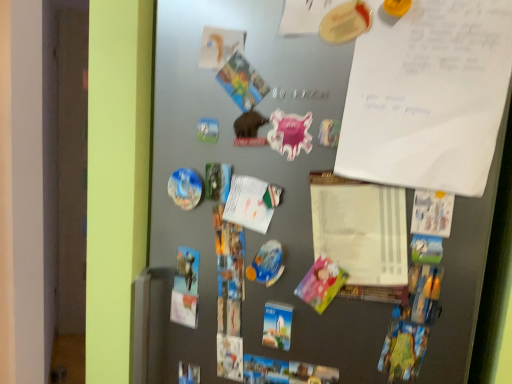
Find the location of `glossy plastic magnet at center-left, the second art positioned from the front`. glossy plastic magnet at center-left, the second art positioned from the front is located at coordinates (185, 188).

Where is `white paper at center`? This screenshot has height=384, width=512. white paper at center is located at coordinates (362, 231).

What is the approximate height of white paper at upper right?

white paper at upper right is 11.91 inches in height.

What are the coordinates of `white paper at upper right` in the screenshot? It's located at (428, 96).

Measure the distance between pink paper postcard at center-right and camera.

pink paper postcard at center-right is 26.39 inches away from camera.

This screenshot has height=384, width=512. Describe the element at coordinates (321, 283) in the screenshot. I see `pink paper postcard at center-right` at that location.

You are a GUI agent. You are given a task and a screenshot of the screen. Output one action in this format:
    pyautogui.click(x=<x>, y=<y>)
    Task: Click on the glossy plastic magnet at center-left, which is the first art from left to right
    The width and height of the screenshot is (512, 384).
    Given the screenshot: What is the action you would take?
    185,188

At what (x,y) coordinates should I click in order to perform the action: click on postcard on the left of white paper at center. Please return your answer as a coordinate pair (x, y). The image size is (512, 384). Looking at the image, I should click on (321, 283).

Is pink paper postcard at center-right bigger than white paper at center?

Actually, pink paper postcard at center-right might be smaller than white paper at center.

Based on the photo, from a real-world perspective, is pink paper postcard at center-right physically above white paper at center?

No, from a real-world perspective, pink paper postcard at center-right is not above white paper at center.

Which of these two, pink paper postcard at center-right or white paper at center, stands shorter?

With less height is pink paper postcard at center-right.

Is white paper at center in contact with pink glossy magnet at center, placed as the 1th art when sorted from right to left?

They are not placed beside each other.

Considering the sizes of objects white paper at center and pink glossy magnet at center, which is counted as the 1th art, starting from the front, in the image provided, who is thinner, white paper at center or pink glossy magnet at center, which is counted as the 1th art, starting from the front,?

With smaller width is pink glossy magnet at center, which is counted as the 1th art, starting from the front.

Which point is more forward, (369, 234) or (309, 124)?

The point (369, 234) is closer to the camera.

From the image's perspective, is white paper at center located above pink glossy magnet at center, placed as the 1th art when sorted from right to left?

Actually, white paper at center appears below pink glossy magnet at center, placed as the 1th art when sorted from right to left, in the image.

Is white paper at upper right inside or outside of white paper at center?

white paper at upper right cannot be found inside white paper at center.

Which is more to the right, white paper at upper right or white paper at center?

white paper at upper right is more to the right.

From a real-world perspective, is white paper at upper right positioned above or below white paper at center?

Clearly, from a real-world perspective, white paper at upper right is above white paper at center.

Identify the location of poster on the right of white paper at center. The width and height of the screenshot is (512, 384). pos(428,96).

Is pink paper postcard at center-right to the left of metallic gray fridge at center from the viewer's perspective?

Incorrect, pink paper postcard at center-right is not on the left side of metallic gray fridge at center.

Can you confirm if pink paper postcard at center-right is taller than metallic gray fridge at center?

No.

From a real-world perspective, is pink paper postcard at center-right under metallic gray fridge at center?

Indeed, from a real-world perspective, pink paper postcard at center-right is positioned beneath metallic gray fridge at center.

Is pink paper postcard at center-right bigger or smaller than metallic gray fridge at center?

Clearly, pink paper postcard at center-right is smaller in size than metallic gray fridge at center.

Can you confirm if white paper at upper right is thinner than pink glossy magnet at center, which is counted as the 1th art, starting from the front?

In fact, white paper at upper right might be wider than pink glossy magnet at center, which is counted as the 1th art, starting from the front.

Is pink glossy magnet at center, the second art from the left, inside white paper at upper right?

Actually, pink glossy magnet at center, the second art from the left, is outside white paper at upper right.

Is white paper at upper right looking in the opposite direction of pink glossy magnet at center, marked as the 1th art in a top-to-bottom arrangement?

white paper at upper right does not have its back to pink glossy magnet at center, marked as the 1th art in a top-to-bottom arrangement.

The image size is (512, 384). I want to click on poster in front of the pink glossy magnet at center, placed as the 1th art when sorted from right to left, so pyautogui.click(x=428, y=96).

Choose the correct answer: Is glossy plastic magnet at center-left, the second art positioned from the front, inside pink glossy magnet at center, which is counted as the 1th art, starting from the front, or outside it?

glossy plastic magnet at center-left, the second art positioned from the front, cannot be found inside pink glossy magnet at center, which is counted as the 1th art, starting from the front.

Can you confirm if glossy plastic magnet at center-left, which is counted as the first art, starting from the bottom, is wider than pink glossy magnet at center, which is counted as the second art, starting from the back?

Correct, the width of glossy plastic magnet at center-left, which is counted as the first art, starting from the bottom, exceeds that of pink glossy magnet at center, which is counted as the second art, starting from the back.

Considering the sizes of objects glossy plastic magnet at center-left, which appears as the 2th art when viewed from the right, and pink glossy magnet at center, placed as the 1th art when sorted from right to left, in the image provided, who is bigger, glossy plastic magnet at center-left, which appears as the 2th art when viewed from the right, or pink glossy magnet at center, placed as the 1th art when sorted from right to left,?

With larger size is glossy plastic magnet at center-left, which appears as the 2th art when viewed from the right.

Is glossy plastic magnet at center-left, the second art in the top-to-bottom sequence, positioned far away from pink glossy magnet at center, placed as the 1th art when sorted from right to left?

They are positioned close to each other.

Considering the sizes of objects glossy plastic magnet at center-left, which is the first art from left to right, and pink paper postcard at center-right in the image provided, who is taller, glossy plastic magnet at center-left, which is the first art from left to right, or pink paper postcard at center-right?

pink paper postcard at center-right.

From a real-world perspective, is glossy plastic magnet at center-left, the second art in the top-to-bottom sequence, physically located above or below pink paper postcard at center-right?

From a real-world perspective, glossy plastic magnet at center-left, the second art in the top-to-bottom sequence, is physically above pink paper postcard at center-right.

In the image, there is a white paper at center. Find the location of `postcard below it (from the image's perspective)`. postcard below it (from the image's perspective) is located at coordinates tap(321, 283).

Locate an element on the screen. notepad that appears below the pink glossy magnet at center, marked as the 1th art in a top-to-bottom arrangement (from a real-world perspective) is located at coordinates (362, 231).

Based on their spatial positions, is glossy plastic magnet at center-left, the second art positioned from the front, or pink glossy magnet at center, which is counted as the second art, starting from the back, further from metallic gray fridge at center?

Among the two, pink glossy magnet at center, which is counted as the second art, starting from the back, is located further to metallic gray fridge at center.

Estimate the real-world distances between objects in this image. Which object is closer to glossy plastic magnet at center-left, the second art positioned from the front, white paper at upper right or metallic gray fridge at center?

metallic gray fridge at center.

Based on the photo, when comparing their distances from pink glossy magnet at center, marked as the 1th art in a top-to-bottom arrangement, does white paper at center or metallic gray fridge at center seem closer?

Among the two, white paper at center is located nearer to pink glossy magnet at center, marked as the 1th art in a top-to-bottom arrangement.

Which object lies nearer to the anchor point white paper at upper right, white paper at center or metallic gray fridge at center?

white paper at center lies closer to white paper at upper right than the other object.

Estimate the real-world distances between objects in this image. Which object is closer to pink glossy magnet at center, marked as the 1th art in a top-to-bottom arrangement, metallic gray fridge at center or white paper at center?

white paper at center.

Considering their positions, is white paper at center positioned closer to pink paper postcard at center-right than glossy plastic magnet at center-left, marked as the first art in a back-to-front arrangement?

Among the two, white paper at center is located nearer to pink paper postcard at center-right.

Estimate the real-world distances between objects in this image. Which object is further from white paper at center, pink glossy magnet at center, the second art from the left, or white paper at upper right?

pink glossy magnet at center, the second art from the left, lies further to white paper at center than the other object.

Which object lies further to the anchor point metallic gray fridge at center, glossy plastic magnet at center-left, the second art in the top-to-bottom sequence, or white paper at center?

Among the two, glossy plastic magnet at center-left, the second art in the top-to-bottom sequence, is located further to metallic gray fridge at center.

Where is `fridge between white paper at upper right and pink paper postcard at center-right in the up-down direction`? fridge between white paper at upper right and pink paper postcard at center-right in the up-down direction is located at coordinates (256, 177).

Identify the location of fridge located between glossy plastic magnet at center-left, marked as the first art in a back-to-front arrangement, and pink paper postcard at center-right in the left-right direction. Image resolution: width=512 pixels, height=384 pixels. (256, 177).

Image resolution: width=512 pixels, height=384 pixels. In order to click on fridge between white paper at upper right and white paper at center in the vertical direction in this screenshot , I will do `click(256, 177)`.

Find the location of a particular element. This screenshot has width=512, height=384. art positioned between metallic gray fridge at center and glossy plastic magnet at center-left, which is the first art from left to right, from near to far is located at coordinates (290, 133).